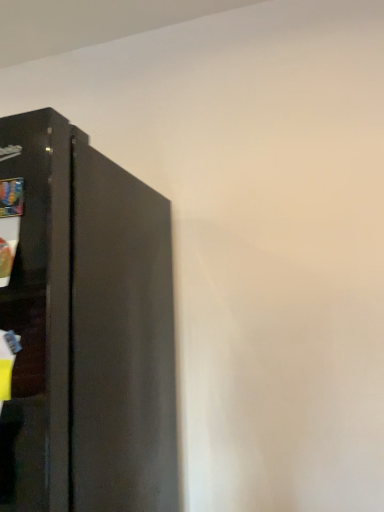
The height and width of the screenshot is (512, 384). What do you see at coordinates (84, 327) in the screenshot? I see `matte black cupboard at left` at bounding box center [84, 327].

In order to face matte black cupboard at left, should I rotate leftwards or rightwards?

To face it directly, rotate left by 21.819 degrees.

Where is `matte black cupboard at left`? matte black cupboard at left is located at coordinates (84, 327).

Where is `matte black cupboard at left`? This screenshot has height=512, width=384. matte black cupboard at left is located at coordinates (84, 327).